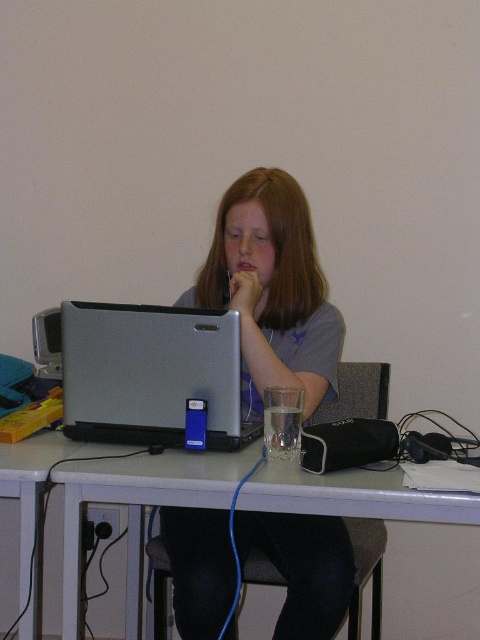
You are the person in the image. Your hand is resting near your mouth, and you want to reach for the point at coordinates point (439,500) and point (210,326). Which point is closer to you?

Point (439,500) is in front of point (210,326), so the point at coordinates point (439,500) is closer to you.